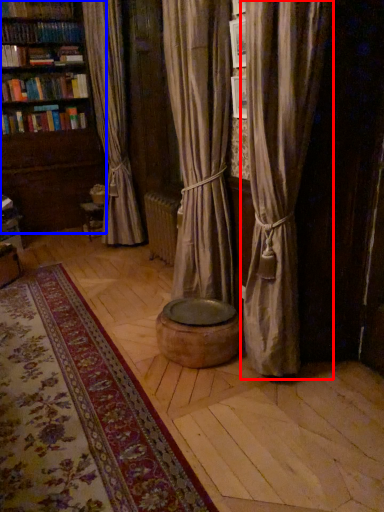
Question: Which of the following is the farthest to the observer, curtain (highlighted by a red box) or bookcase (highlighted by a blue box)?

Choices:
 (A) curtain
 (B) bookcase

Answer: (B)